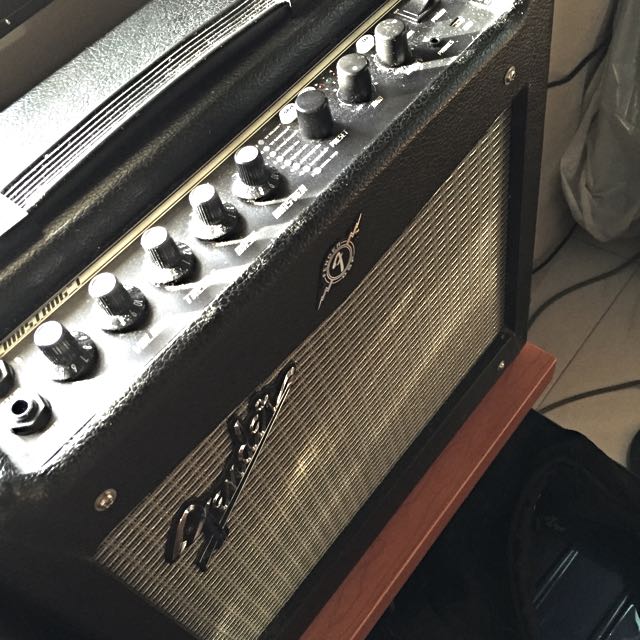
Where is `cables`? cables is located at coordinates (586, 392), (557, 296), (548, 260), (564, 81).